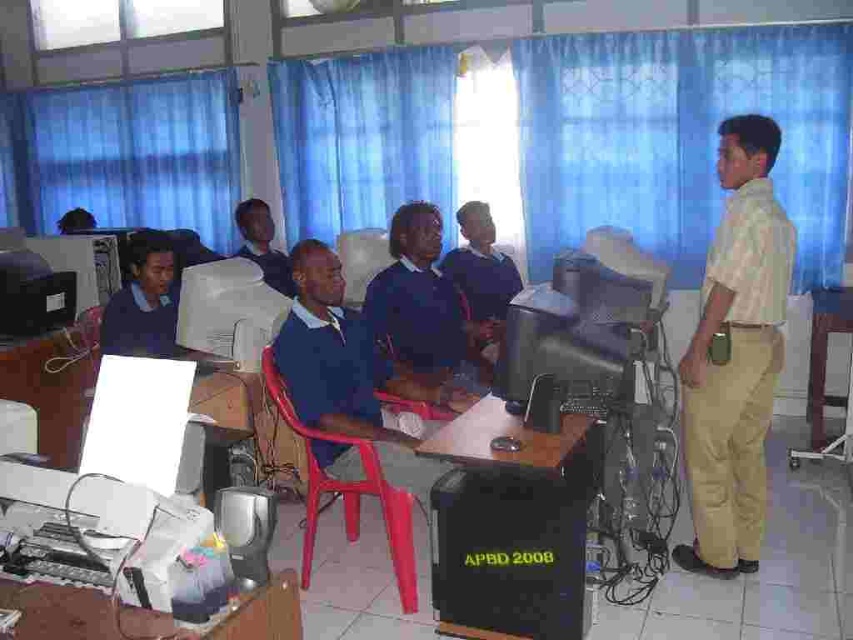
Question: Does white glossy monitor at center appear on the right side of wooden table at right?

Choices:
 (A) no
 (B) yes

Answer: (A)

Question: Can you confirm if wooden table at center is positioned to the left of white plastic printer at lower left?

Choices:
 (A) yes
 (B) no

Answer: (B)

Question: Considering the real-world distances, which object is farthest from the matte blue sweater at left?

Choices:
 (A) red plastic chair at center
 (B) wooden table at right

Answer: (B)

Question: Which of the following is the farthest from the observer?

Choices:
 (A) blue matte shirt at center
 (B) matte blue sweater at left
 (C) white glossy monitor at center

Answer: (C)

Question: Does white glossy monitor at center appear under wooden table at right?

Choices:
 (A) yes
 (B) no

Answer: (B)

Question: Which point is farther from the camera taking this photo?

Choices:
 (A) (164, 304)
 (B) (343, 477)

Answer: (A)